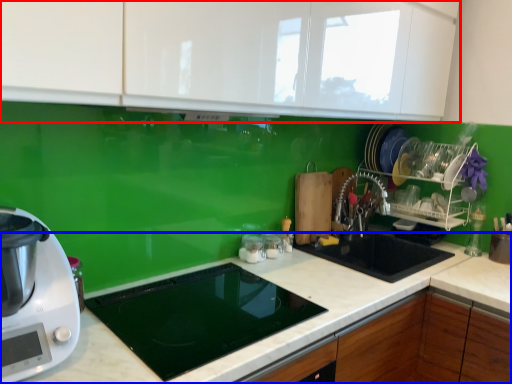
Question: Among these objects, which one is nearest to the camera, cabinetry (highlighted by a red box) or countertop (highlighted by a blue box)?

Choices:
 (A) cabinetry
 (B) countertop

Answer: (A)